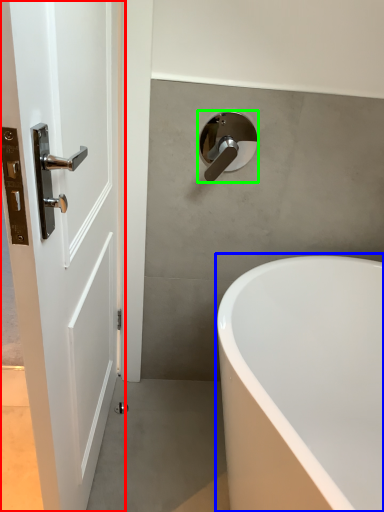
Question: Which object is the closest to the door (highlighted by a red box)? Choose among these: bathtub (highlighted by a blue box) or tap (highlighted by a green box).

Choices:
 (A) bathtub
 (B) tap

Answer: (A)